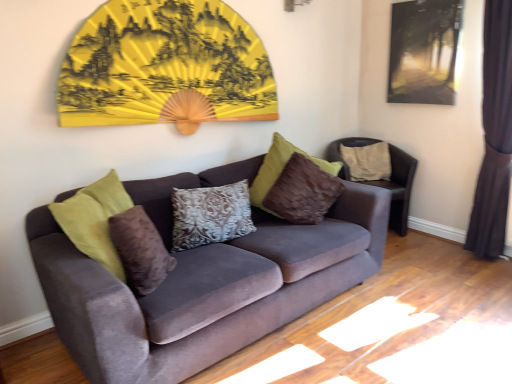
The image size is (512, 384). Find the location of `vacant space to the right of velvet couch at center`. vacant space to the right of velvet couch at center is located at coordinates (412, 311).